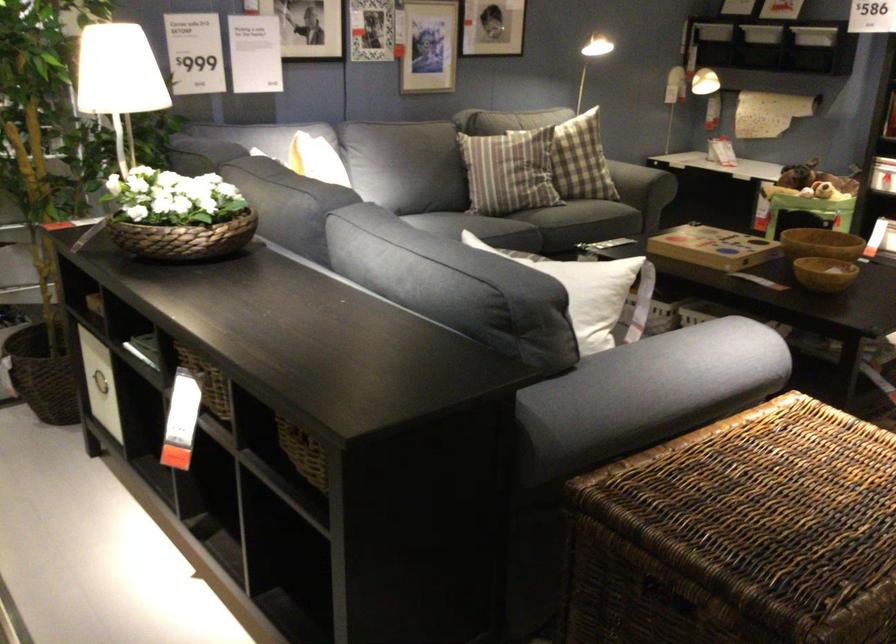
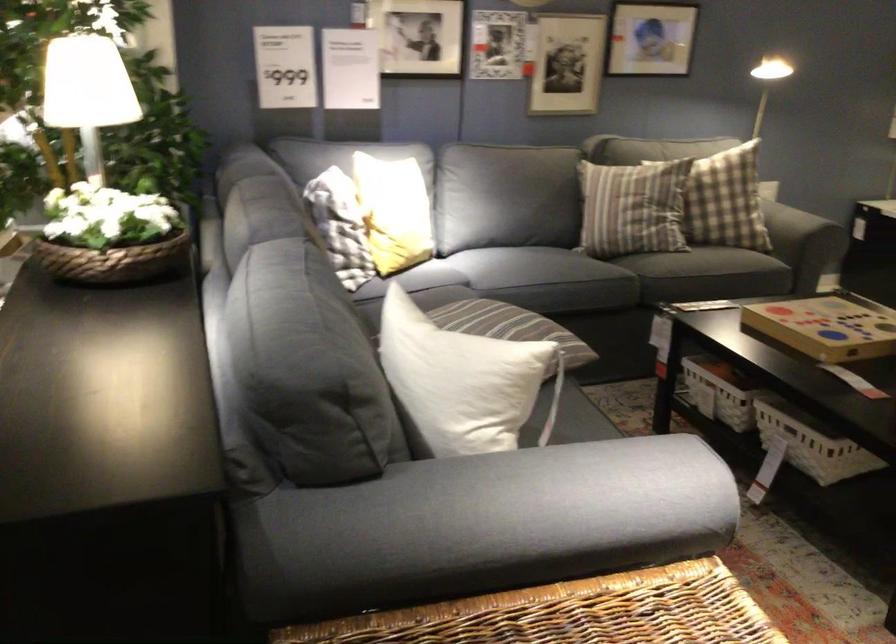
In the second image, find the point that corresponds to point (200, 222) in the first image.

(109, 236)